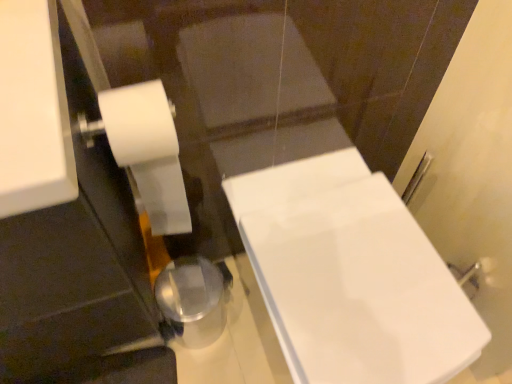
The image size is (512, 384). In order to click on free space above white glossy bathtub at center (from a real-world perspective) in this screenshot , I will do `click(356, 269)`.